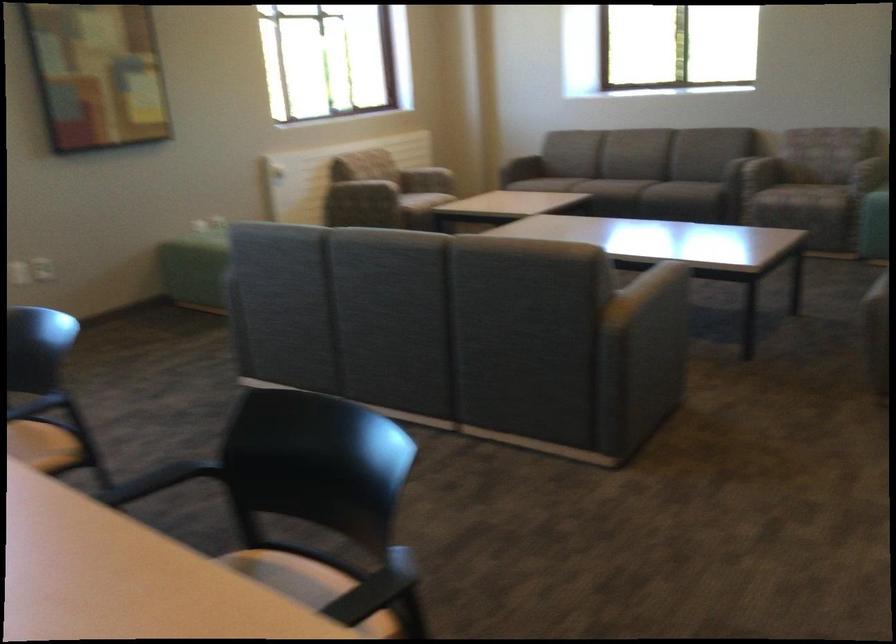
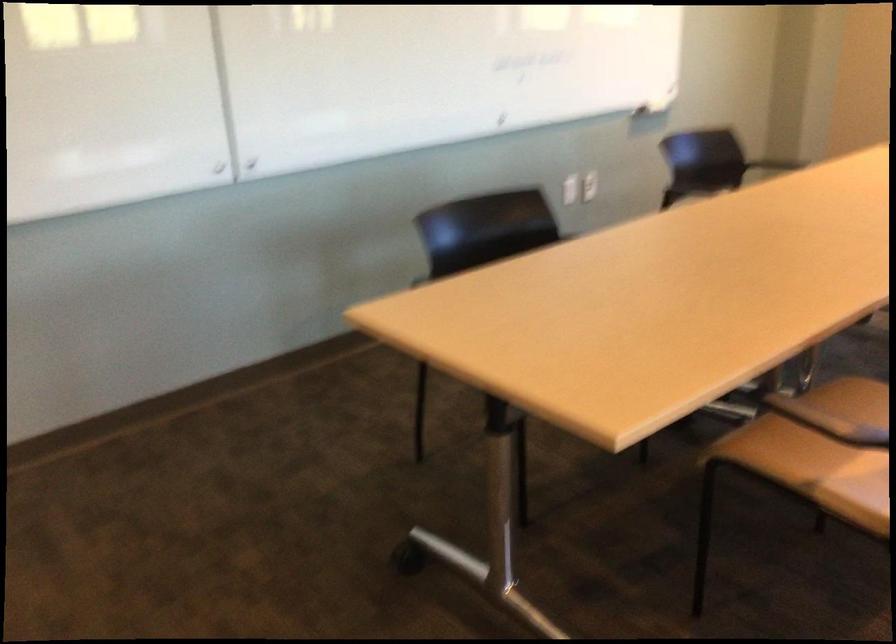
Question: I am providing you with two images of the same scene from different viewpoints. Which of the following objects are not visible in image2?

Choices:
 (A) chair armrest
 (B) brown chair sitting surface
 (C) white light switch
 (D) white phone charger

Answer: (A)